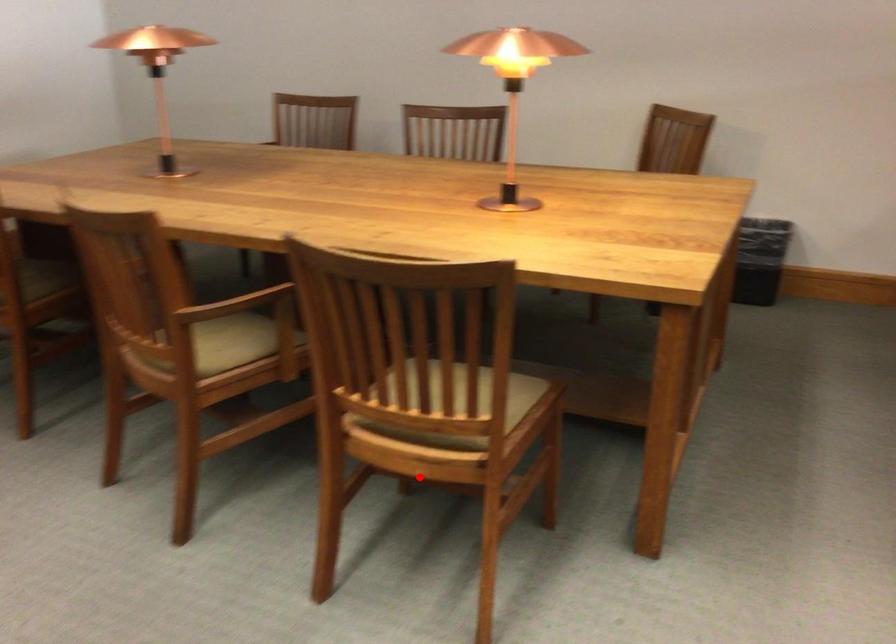
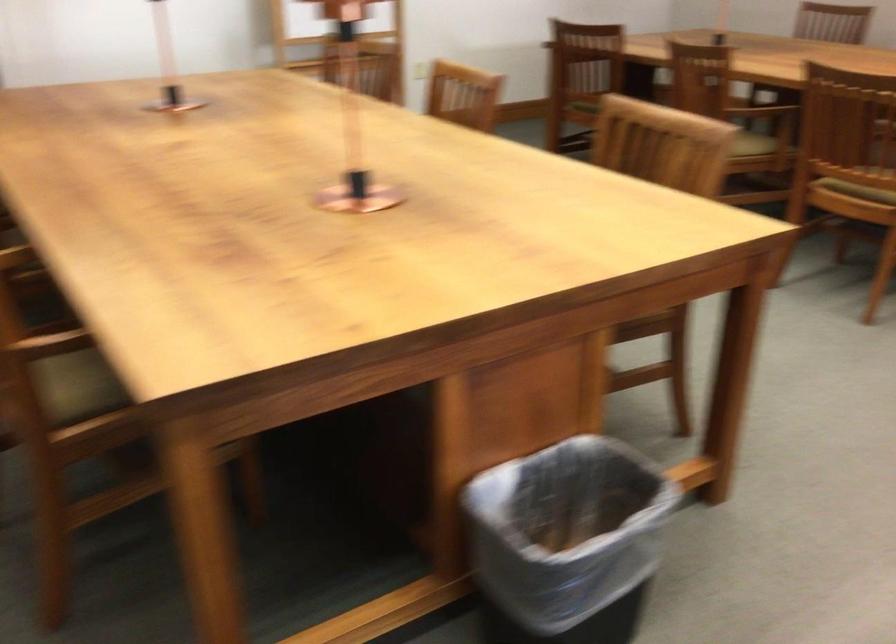
Locate, in the second image, the point that corresponds to the highlighted location in the first image.

(857, 191)